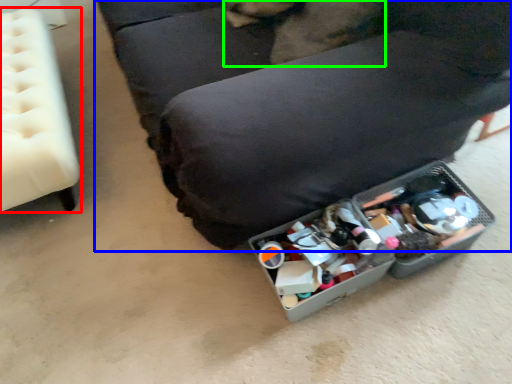
Question: Which is farther away from furniture (highlighted by a red box)? furniture (highlighted by a blue box) or animal (highlighted by a green box)?

Choices:
 (A) furniture
 (B) animal

Answer: (B)